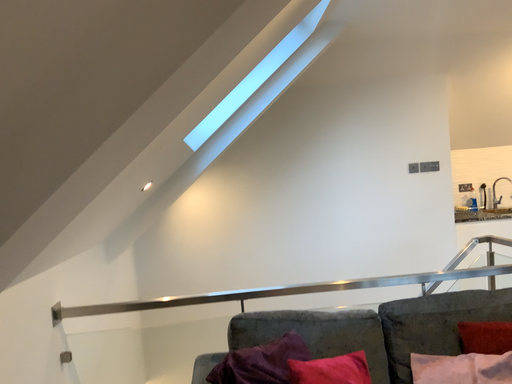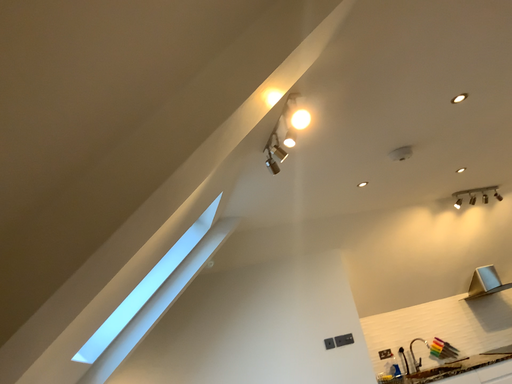
Question: How did the camera likely rotate when shooting the video?

Choices:
 (A) rotated downward
 (B) rotated upward

Answer: (B)